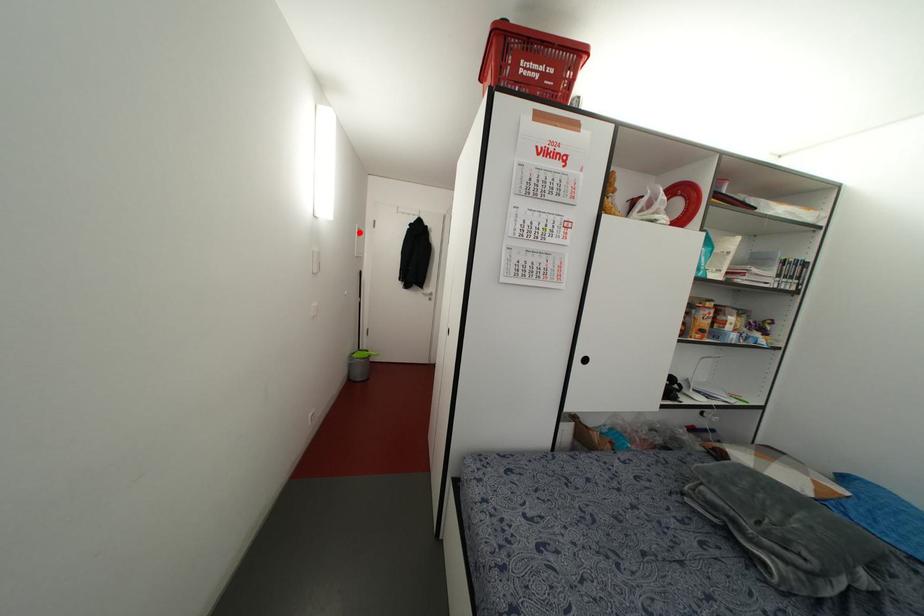
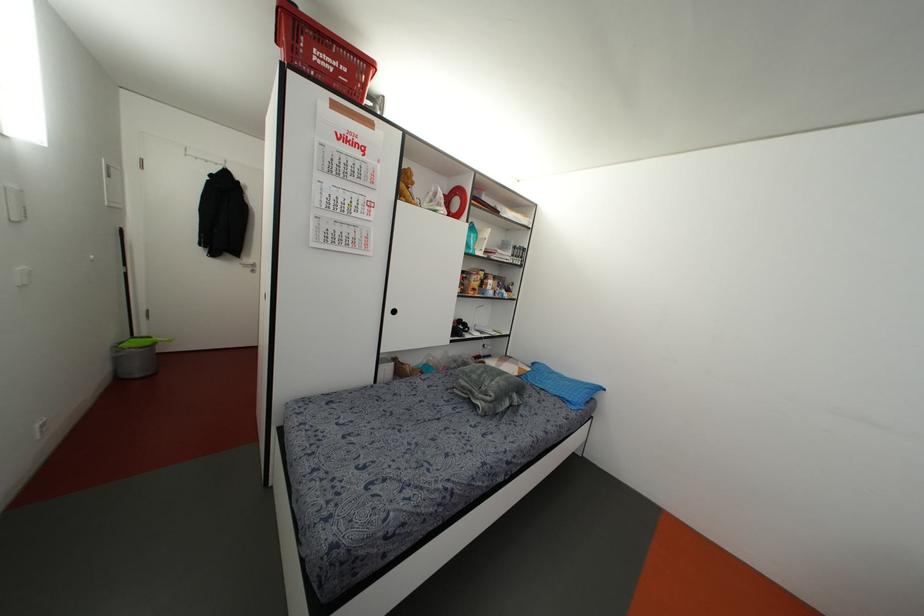
Question: A red point is marked in image1. In image2, is the corresponding 3D point closer to the camera or farther? Reply with the corresponding letter.

Choices:
 (A) The corresponding 3D point is closer.
 (B) The corresponding 3D point is farther.

Answer: (B)